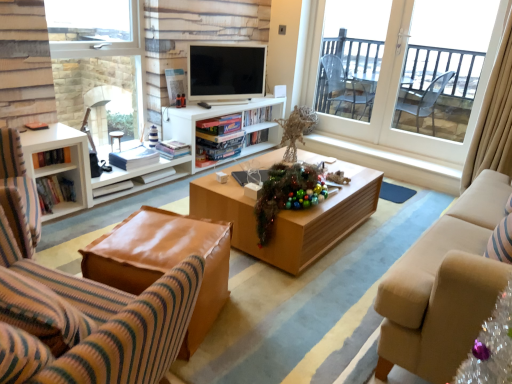
Question: Is clear glass window at left, arranged as the first window when viewed from the left, facing towards white matte entertainment center at center?

Choices:
 (A) no
 (B) yes

Answer: (B)

Question: Considering the relative positions of clear glass window at left, arranged as the first window when viewed from the left, and white matte entertainment center at center in the image provided, is clear glass window at left, arranged as the first window when viewed from the left, to the left of white matte entertainment center at center from the viewer's perspective?

Choices:
 (A) no
 (B) yes

Answer: (B)

Question: Is clear glass window at left, arranged as the first window when viewed from the left, surrounding white matte entertainment center at center?

Choices:
 (A) no
 (B) yes

Answer: (A)

Question: Does clear glass window at left, acting as the second window starting from the right, have a lesser height compared to white matte entertainment center at center?

Choices:
 (A) yes
 (B) no

Answer: (B)

Question: Considering the relative positions of clear glass window at left, arranged as the first window when viewed from the left, and white matte entertainment center at center in the image provided, is clear glass window at left, arranged as the first window when viewed from the left, to the right of white matte entertainment center at center from the viewer's perspective?

Choices:
 (A) yes
 (B) no

Answer: (B)

Question: Is clear glass window at left, acting as the second window starting from the right, inside the boundaries of transparent glass door at upper right, which is counted as the second window, starting from the left, or outside?

Choices:
 (A) outside
 (B) inside

Answer: (A)

Question: From the image's perspective, is clear glass window at left, acting as the second window starting from the right, above or below transparent glass door at upper right, the first window in the right-to-left sequence?

Choices:
 (A) above
 (B) below

Answer: (B)

Question: Is clear glass window at left, arranged as the first window when viewed from the left, in front of or behind transparent glass door at upper right, the first window in the right-to-left sequence, in the image?

Choices:
 (A) front
 (B) behind

Answer: (A)

Question: Would you say clear glass window at left, acting as the second window starting from the right, is to the left or to the right of transparent glass door at upper right, which is counted as the second window, starting from the left, in the picture?

Choices:
 (A) right
 (B) left

Answer: (B)

Question: Considering the relative positions of transparent glass door at upper right, which is counted as the second window, starting from the left, and leather ottoman at lower left in the image provided, is transparent glass door at upper right, which is counted as the second window, starting from the left, to the left or to the right of leather ottoman at lower left?

Choices:
 (A) right
 (B) left

Answer: (A)

Question: Based on their sizes in the image, would you say transparent glass door at upper right, the first window in the right-to-left sequence, is bigger or smaller than leather ottoman at lower left?

Choices:
 (A) big
 (B) small

Answer: (A)

Question: Considering their positions, is transparent glass door at upper right, the first window in the right-to-left sequence, located in front of or behind leather ottoman at lower left?

Choices:
 (A) behind
 (B) front

Answer: (A)

Question: From a real-world perspective, is transparent glass door at upper right, which is counted as the second window, starting from the left, physically located above or below leather ottoman at lower left?

Choices:
 (A) above
 (B) below

Answer: (A)

Question: In terms of width, does beige fabric curtain at right look wider or thinner when compared to white matte entertainment center at center?

Choices:
 (A) wide
 (B) thin

Answer: (B)

Question: From the image's perspective, is beige fabric curtain at right above or below white matte entertainment center at center?

Choices:
 (A) above
 (B) below

Answer: (A)